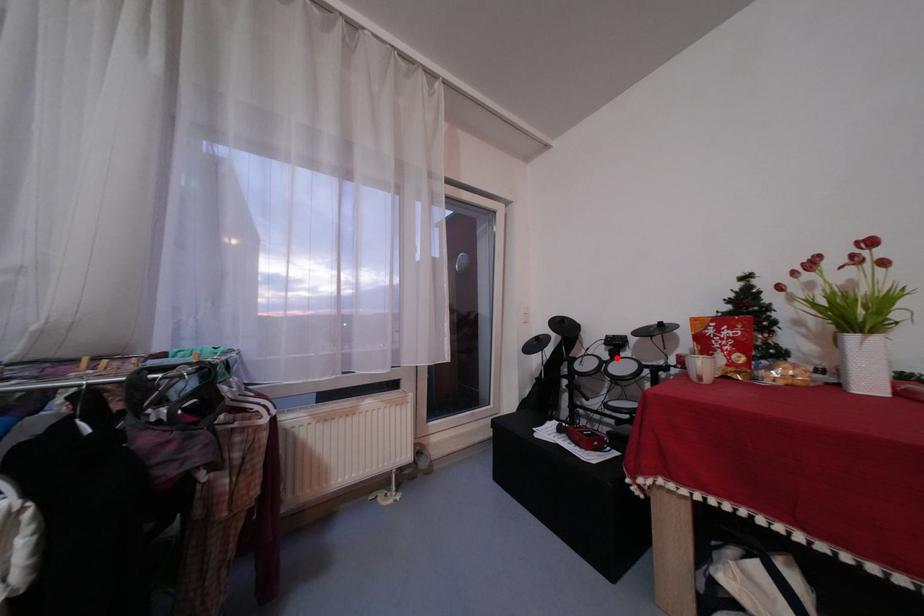
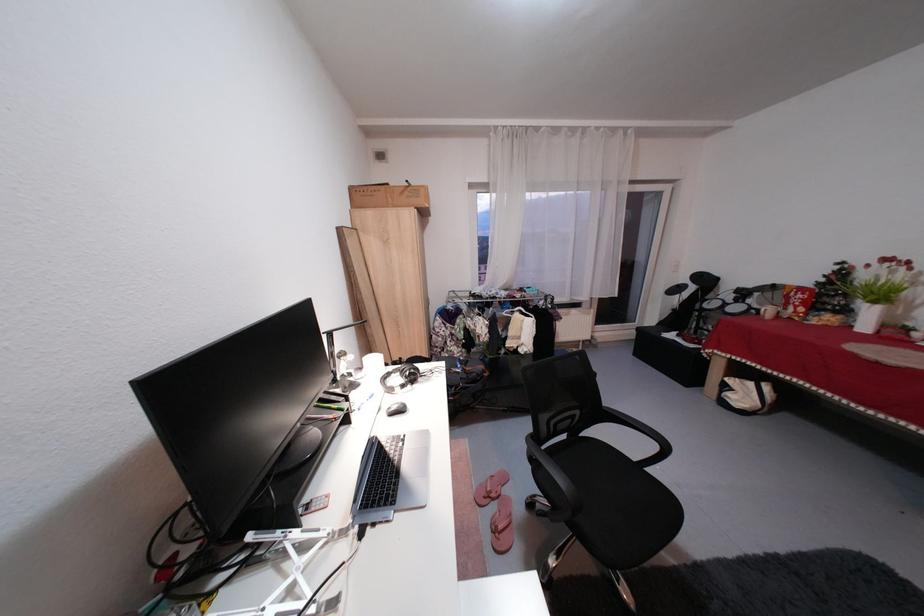
Where in the second image is the point corresponding to the highlighted location from the first image?

(742, 302)